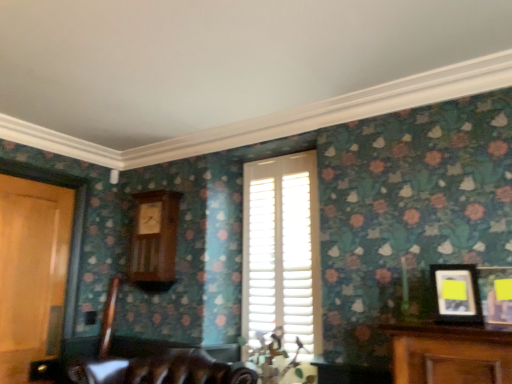
Question: Is yellow matte picture frame at right, positioned as the 1th picture frame in right-to-left order, outside of matte black picture frame at right, the second picture frame from the right?

Choices:
 (A) no
 (B) yes

Answer: (B)

Question: Does yellow matte picture frame at right, the second picture frame viewed from the left, contain matte black picture frame at right, the first picture frame positioned from the left?

Choices:
 (A) no
 (B) yes

Answer: (A)

Question: Is yellow matte picture frame at right, the second picture frame viewed from the left, next to matte black picture frame at right, the first picture frame positioned from the left, and touching it?

Choices:
 (A) yes
 (B) no

Answer: (A)

Question: Could you tell me if yellow matte picture frame at right, positioned as the 1th picture frame in right-to-left order, is facing matte black picture frame at right, the second picture frame from the right?

Choices:
 (A) yes
 (B) no

Answer: (B)

Question: Is yellow matte picture frame at right, the second picture frame viewed from the left, thinner than matte black picture frame at right, the first picture frame positioned from the left?

Choices:
 (A) yes
 (B) no

Answer: (B)

Question: From the image's perspective, is yellow matte picture frame at right, positioned as the 1th picture frame in right-to-left order, located beneath matte black picture frame at right, the first picture frame positioned from the left?

Choices:
 (A) yes
 (B) no

Answer: (B)

Question: Can you confirm if white wooden shutters at center is thinner than wooden clock at center-left?

Choices:
 (A) no
 (B) yes

Answer: (B)

Question: Is white wooden shutters at center looking in the opposite direction of wooden clock at center-left?

Choices:
 (A) no
 (B) yes

Answer: (A)

Question: Is the depth of white wooden shutters at center greater than that of wooden clock at center-left?

Choices:
 (A) yes
 (B) no

Answer: (B)

Question: Is white wooden shutters at center shorter than wooden clock at center-left?

Choices:
 (A) no
 (B) yes

Answer: (A)

Question: Does white wooden shutters at center have a larger size compared to wooden clock at center-left?

Choices:
 (A) no
 (B) yes

Answer: (B)

Question: Is white wooden shutters at center beside wooden clock at center-left?

Choices:
 (A) yes
 (B) no

Answer: (B)

Question: Considering the relative positions of white wooden shutters at center and yellow matte picture frame at right, the second picture frame viewed from the left, in the image provided, is white wooden shutters at center in front of yellow matte picture frame at right, the second picture frame viewed from the left,?

Choices:
 (A) no
 (B) yes

Answer: (A)